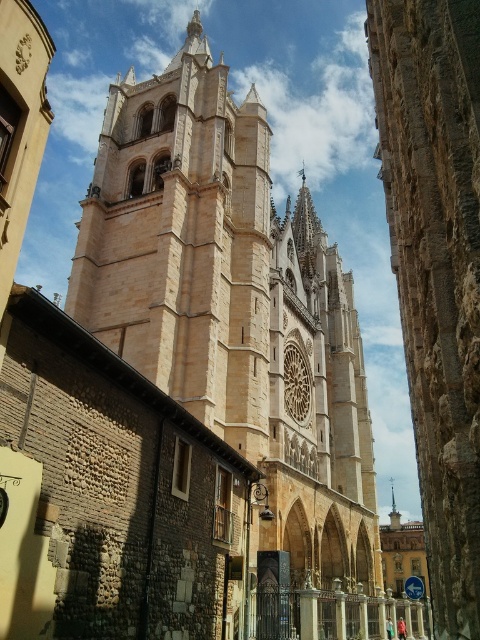
Question: Is beige stone tower at center positioned at the back of smooth silver spire at center?

Choices:
 (A) yes
 (B) no

Answer: (B)

Question: Which point is farther from the camera taking this photo?

Choices:
 (A) (391, 492)
 (B) (197, 412)

Answer: (A)

Question: Which of the following is the closest to the observer?

Choices:
 (A) beige stone tower at center
 (B) smooth silver spire at center

Answer: (A)

Question: Is beige stone tower at center above smooth silver spire at center?

Choices:
 (A) yes
 (B) no

Answer: (A)

Question: Considering the relative positions of beige stone tower at center and smooth silver spire at center in the image provided, where is beige stone tower at center located with respect to smooth silver spire at center?

Choices:
 (A) below
 (B) above

Answer: (B)

Question: Which of the following is the farthest from the observer?

Choices:
 (A) (397, 515)
 (B) (238, 224)

Answer: (A)